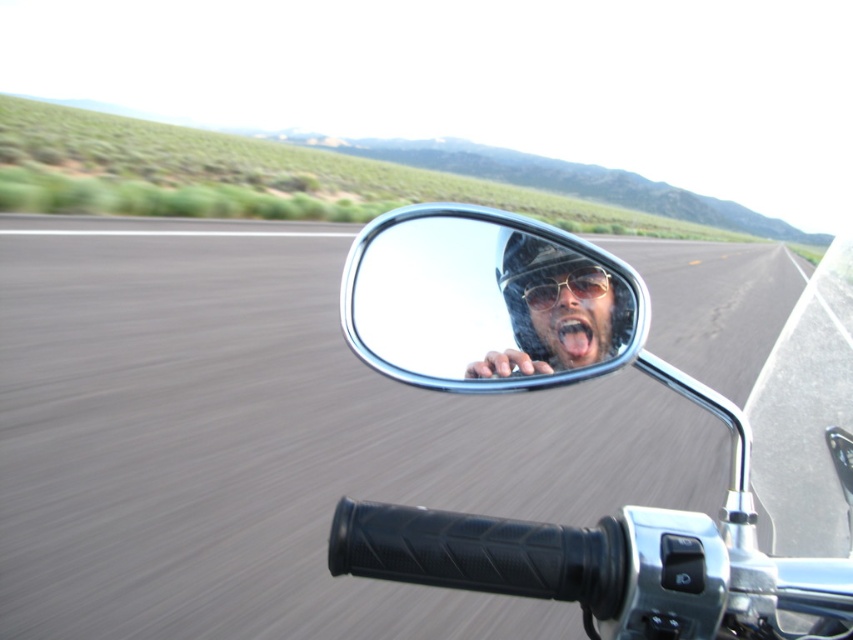
You are a drone operator trying to capture the motorcycle scene. The drone is currently positioned at point 0.700, 0.450. Which direction should you move the drone to align it with the asphalt road at center?

The asphalt road at center is located at point (383,444). Since the drone is at (383,448), it is slightly to the right of the road. Move the drone to the left to align with the asphalt road at center.

You are a photographer trying to capture the reflection in the side mirror of the motorcycle. You notice the shiny metallic helmet at side mirror and the metallic reflective sunglasses at center. Which object would appear larger in the reflection if both are visible?

The shiny metallic helmet at side mirror would appear larger in the reflection because it is closer to the mirror compared to the metallic reflective sunglasses at center.

You are a motorcycle rider looking at the road ahead. Which object, the asphalt road at center or the metallic reflective sunglasses at center, appears taller in the scene?

The asphalt road at center appears taller than the metallic reflective sunglasses at center in the scene.